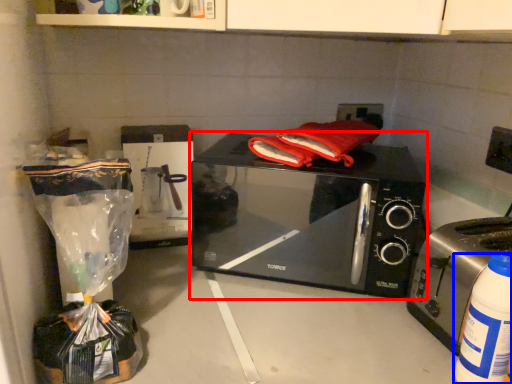
Question: Which of the following is the farthest to the observer, microwave oven (highlighted by a red box) or bottle (highlighted by a blue box)?

Choices:
 (A) microwave oven
 (B) bottle

Answer: (A)